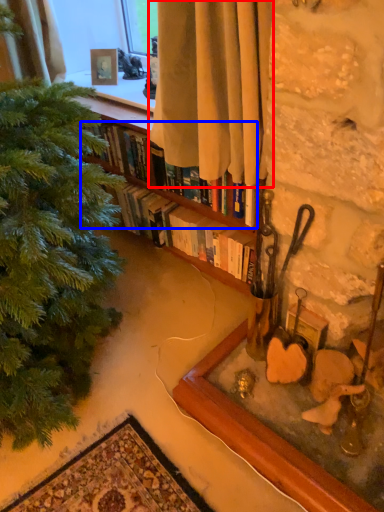
Question: Among these objects, which one is farthest to the camera, curtain (highlighted by a red box) or book (highlighted by a blue box)?

Choices:
 (A) curtain
 (B) book

Answer: (B)